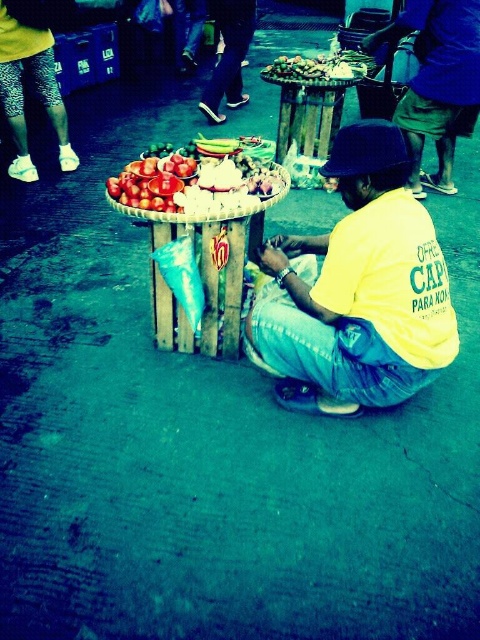
Question: Does matte blue shirt at center appear on the right side of wooden basket at center?

Choices:
 (A) no
 (B) yes

Answer: (B)

Question: Can you confirm if yellow cotton shirt at center is positioned above wooden basket at center?

Choices:
 (A) yes
 (B) no

Answer: (B)

Question: Considering the real-world distances, which object is farthest from the matte blue shirt at center?

Choices:
 (A) yellow cotton shirt at center
 (B) wooden basket at center
 (C) shiny red tomatoes at center

Answer: (A)

Question: Among these objects, which one is farthest from the camera?

Choices:
 (A) wooden basket at center
 (B) yellow cotton shirt at center

Answer: (A)

Question: Which point appears closest to the camera in this image?

Choices:
 (A) (374, 268)
 (B) (242, 161)
 (C) (204, 332)
 (D) (420, 22)

Answer: (A)

Question: Is matte blue shirt at center below shiny red tomatoes at center?

Choices:
 (A) no
 (B) yes

Answer: (A)